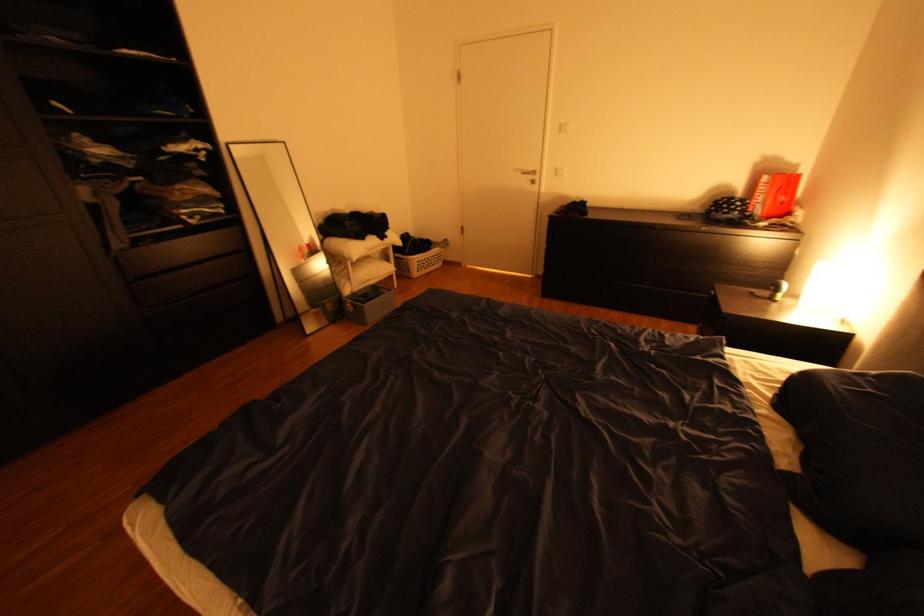
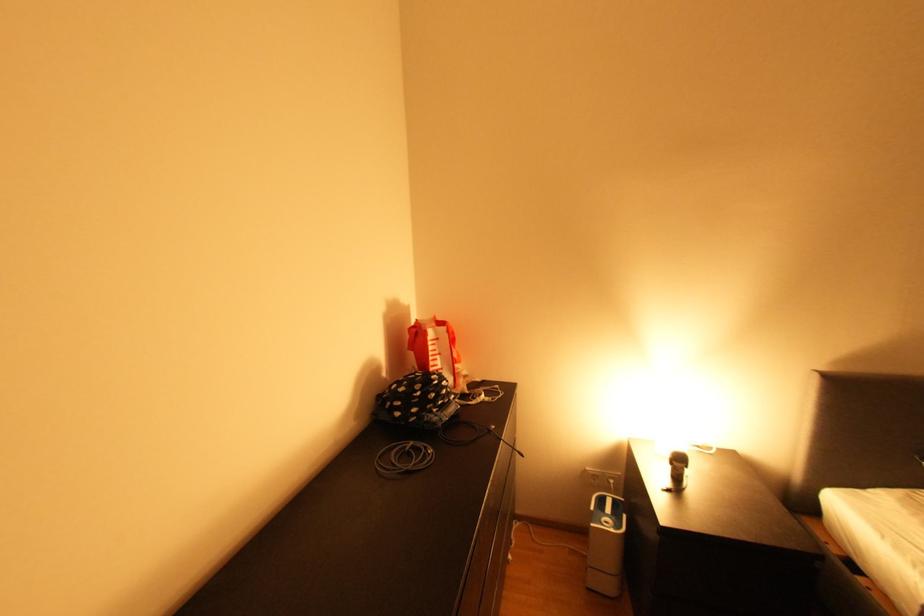
Locate, in the second image, the point that corresponds to (748,208) in the first image.

(457, 389)